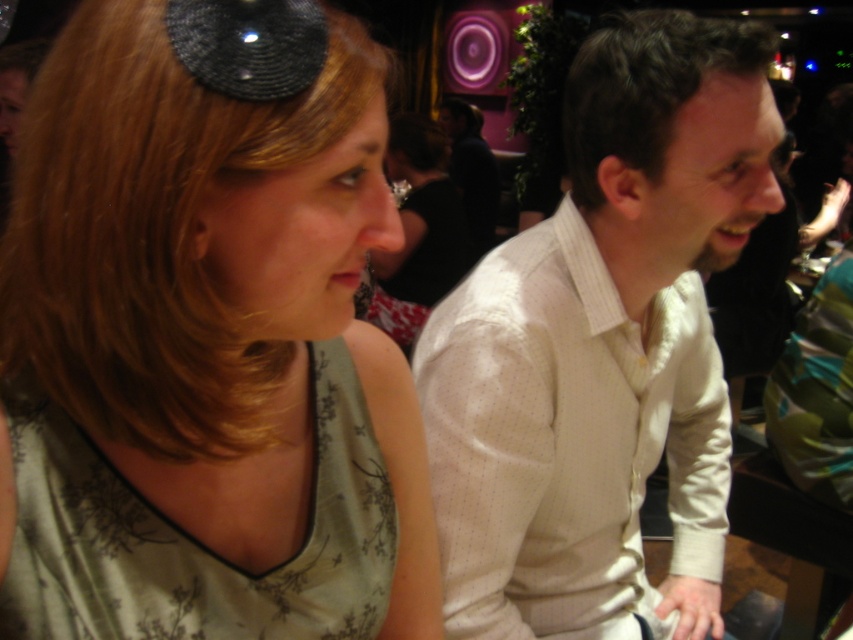
Question: Does green floral fabric at center have a larger size compared to matte black hair at center?

Choices:
 (A) yes
 (B) no

Answer: (B)

Question: Which object appears farthest from the camera in this image?

Choices:
 (A) matte black hair at center
 (B) white textured shirt at right
 (C) green floral fabric at center

Answer: (A)

Question: Is green floral fabric at center positioned behind matte black hair at center?

Choices:
 (A) no
 (B) yes

Answer: (A)

Question: Estimate the real-world distances between objects in this image. Which object is farther from the white textured shirt at right?

Choices:
 (A) green floral fabric at center
 (B) matte black hair at center

Answer: (B)

Question: Where is white textured shirt at right located in relation to matte black hair at center in the image?

Choices:
 (A) above
 (B) below

Answer: (B)

Question: Which of the following is the closest to the observer?

Choices:
 (A) white textured shirt at right
 (B) matte black hair at center
 (C) green floral fabric at center

Answer: (C)